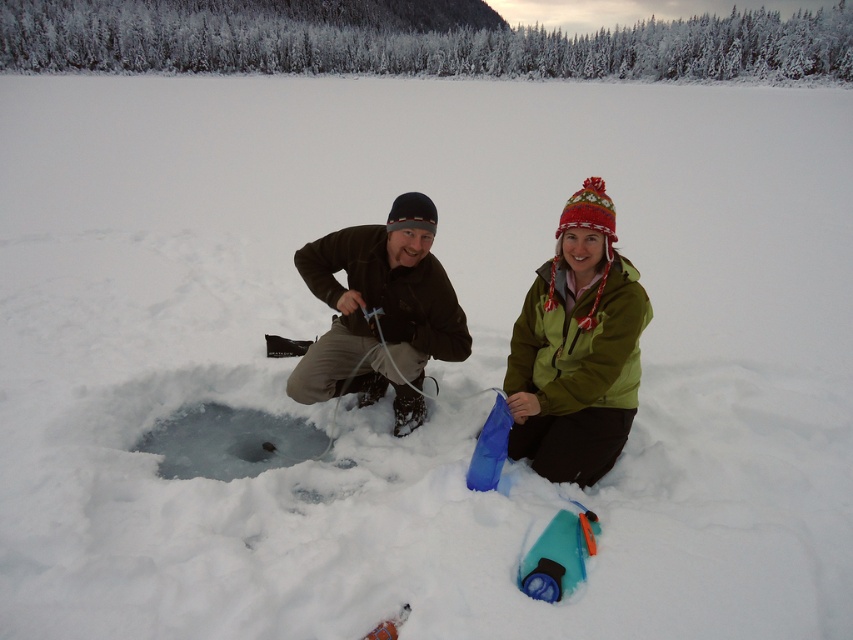
You are an observer standing behind both individuals. Which jacket is closer to you, the dark brown jacket at center or the dark brown fabric jacket at center?

The dark brown fabric jacket at center is closer to you because it is positioned on the left side of the dark brown jacket at center, which is further away.

You are standing at the origin point of the coordinate system. You want to move towards the dark brown jacket at center. In which direction should you move?

You should move towards the direction of the dark brown jacket at center located at coordinate point 0.547 on the x axis and 0.678 on the y axis.

You are an observer standing at the edge of the frozen lake. You notice two jackets on the ice. The first is labeled as dark brown jacket at center, and the second is dark brown fabric jacket at center. Which of these two jackets appears to be smaller in size?

The dark brown jacket at center is smaller in size compared to the dark brown fabric jacket at center.